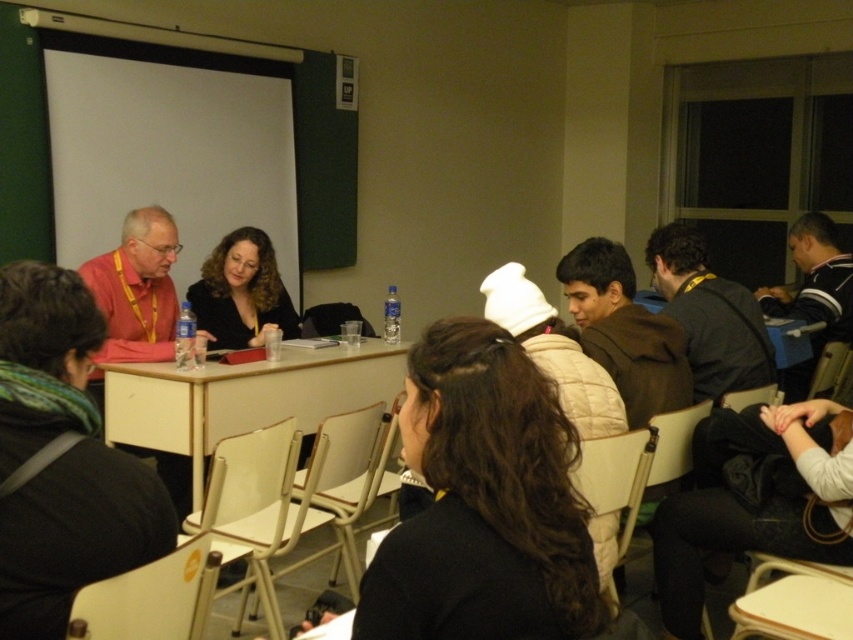
Which is above, dark brown hair at center or striped sweater at right?

striped sweater at right

Is dark brown hair at center in front of striped sweater at right?

Yes, it is.

Is point (57, 378) closer to viewer compared to point (793, 241)?

Yes.

At what (x,y) coordinates should I click in order to perform the action: click on dark brown hair at center. Please return your answer as a coordinate pair (x, y). The width and height of the screenshot is (853, 640). Looking at the image, I should click on (62, 460).

Which of these two, dark brown hair at center or beige wood table at center, stands taller?

With more height is dark brown hair at center.

Does dark brown hair at center appear under beige wood table at center?

Incorrect, dark brown hair at center is not positioned below beige wood table at center.

Between point (6, 596) and point (242, 432), which one is positioned behind?

The point (242, 432) is more distant.

Where is `dark brown hair at center`? This screenshot has width=853, height=640. dark brown hair at center is located at coordinates (62, 460).

Who is shorter, black matte jacket at center or curly brown hair at center?

black matte jacket at center is shorter.

Who is more forward, (x=517, y=490) or (x=254, y=243)?

Positioned in front is point (x=517, y=490).

Who is more distant from viewer, (416, 429) or (196, 289)?

The point (196, 289) is behind.

The height and width of the screenshot is (640, 853). In order to click on black matte jacket at center in this screenshot , I will do `click(485, 502)`.